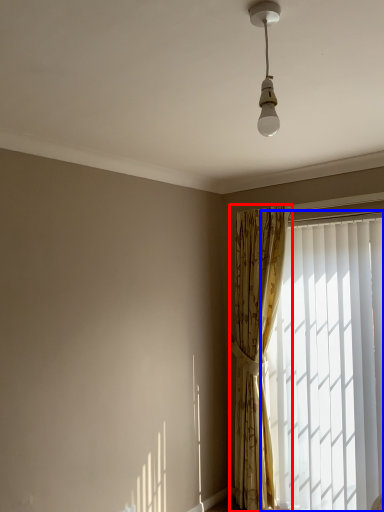
Question: Which object is further to the camera taking this photo, curtain (highlighted by a red box) or window (highlighted by a blue box)?

Choices:
 (A) curtain
 (B) window

Answer: (A)